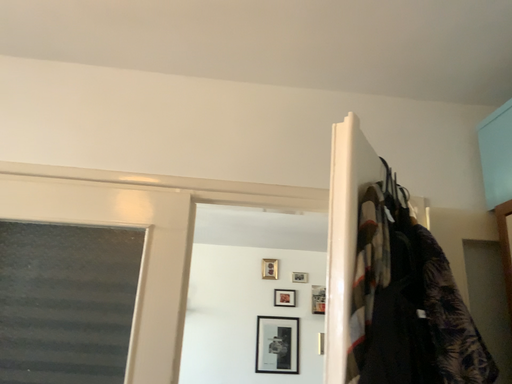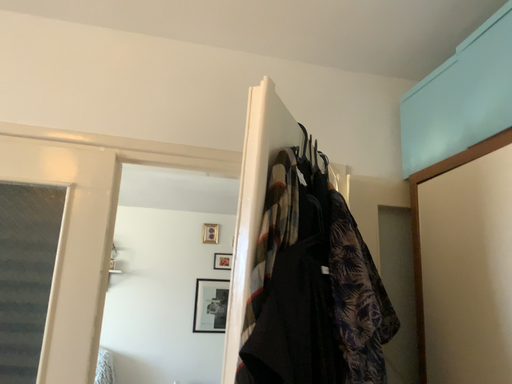
Question: Which way did the camera rotate in the video?

Choices:
 (A) rotated left
 (B) rotated right

Answer: (B)